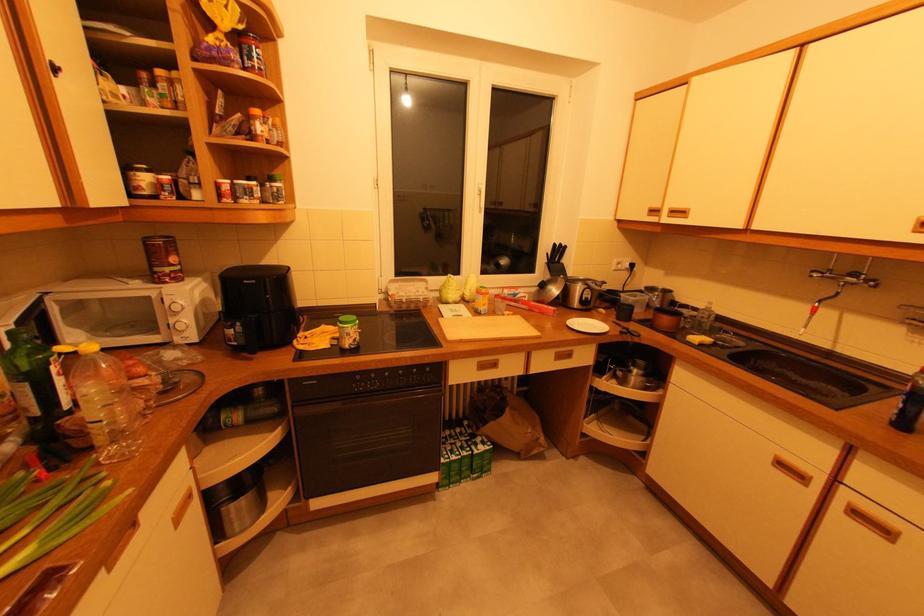
Where is `green-capped shaker`? Image resolution: width=924 pixels, height=616 pixels. green-capped shaker is located at coordinates (35, 383).